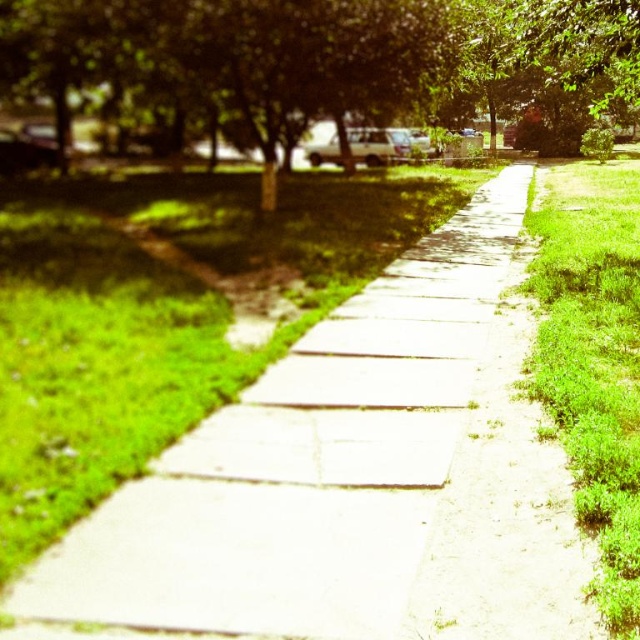
Which is more to the left, green leafy tree at center or green grass at right?

From the viewer's perspective, green leafy tree at center appears more on the left side.

Is green leafy tree at center below green grass at right?

No, green leafy tree at center is not below green grass at right.

This screenshot has width=640, height=640. Identify the location of green leafy tree at center. (314, 60).